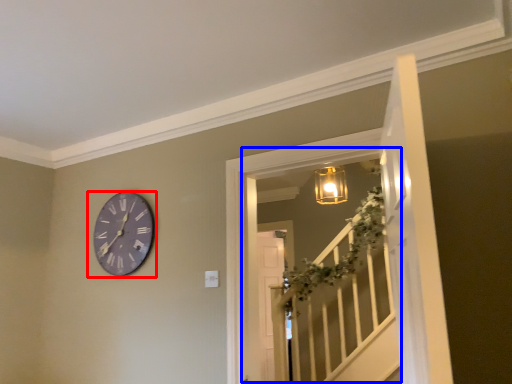
Question: Among these objects, which one is nearest to the camera, wall clock (highlighted by a red box) or window (highlighted by a blue box)?

Choices:
 (A) wall clock
 (B) window

Answer: (B)